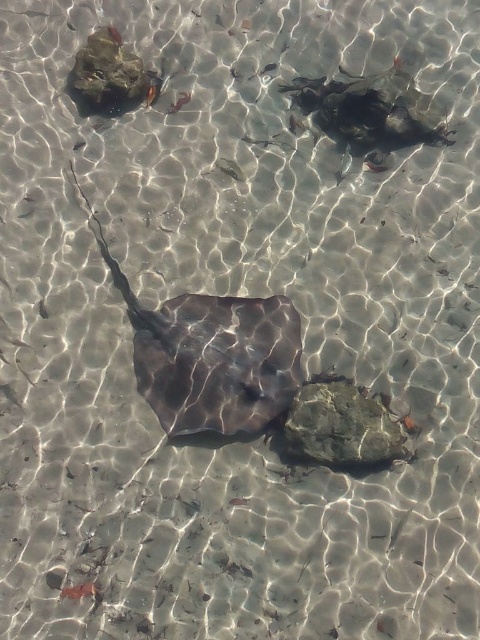
Is smooth dark gray stingray at center taller than green mossy rock at center?

Yes, smooth dark gray stingray at center is taller than green mossy rock at center.

Does smooth dark gray stingray at center appear on the right side of green mossy rock at center?

No, smooth dark gray stingray at center is not to the right of green mossy rock at center.

Consider the image. Who is more forward, (196, 348) or (384, 426)?

Point (384, 426) is more forward.

You are a GUI agent. You are given a task and a screenshot of the screen. Output one action in this format:
    pyautogui.click(x=<x>, y=<y>)
    Task: Click on the smooth dark gray stingray at center
    This screenshot has height=640, width=480.
    Given the screenshot: What is the action you would take?
    click(x=217, y=362)